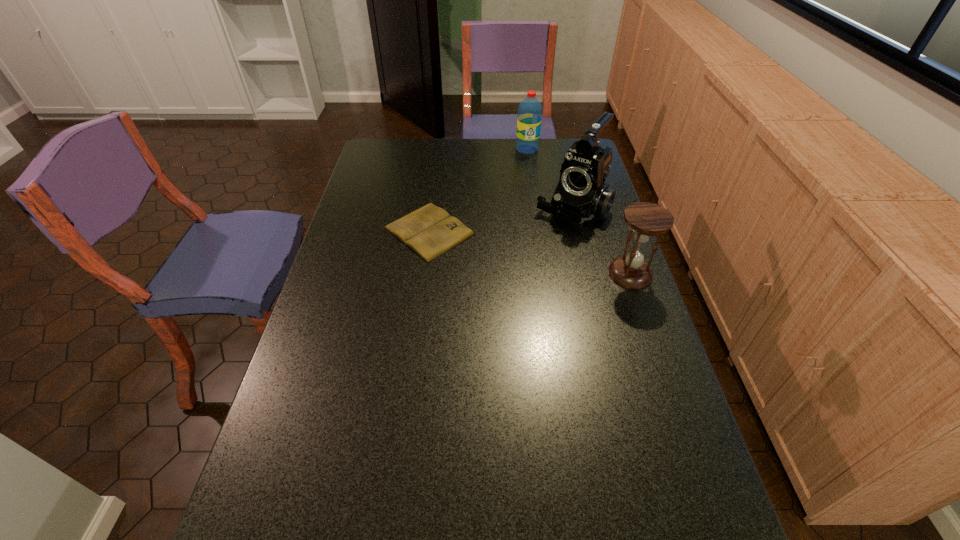
Identify the location of free space at the far left corner. (400, 152).

Identify the location of vacant space at the near right corner. The image size is (960, 540). (666, 521).

The height and width of the screenshot is (540, 960). What are the coordinates of `vacant point located between the shortest object and the water bottle` in the screenshot? It's located at (478, 190).

Image resolution: width=960 pixels, height=540 pixels. I want to click on blank region between the hourglass and the shortest object, so click(530, 252).

The height and width of the screenshot is (540, 960). In order to click on vacant area between the camcorder and the shortest object in this screenshot , I will do `click(501, 219)`.

You are a GUI agent. You are given a task and a screenshot of the screen. Output one action in this format:
    pyautogui.click(x=<x>, y=<y>)
    Task: Click on the free space between the shortest object and the tallest object
    Image resolution: width=960 pixels, height=540 pixels.
    Given the screenshot: What is the action you would take?
    pyautogui.click(x=501, y=219)

Locate an element on the screen. The image size is (960, 540). free space between the leftmost object and the camcorder is located at coordinates (501, 219).

The image size is (960, 540). I want to click on empty space between the tallest object and the water bottle, so click(x=550, y=178).

You are a GUI agent. You are given a task and a screenshot of the screen. Output one action in this format:
    pyautogui.click(x=<x>, y=<y>)
    Task: Click on the vacant area that lies between the shortest object and the hourglass
    This screenshot has width=960, height=540.
    Given the screenshot: What is the action you would take?
    pos(530,252)

The height and width of the screenshot is (540, 960). In order to click on unoccupied area between the hourglass and the shortest object in this screenshot , I will do tap(530, 252).